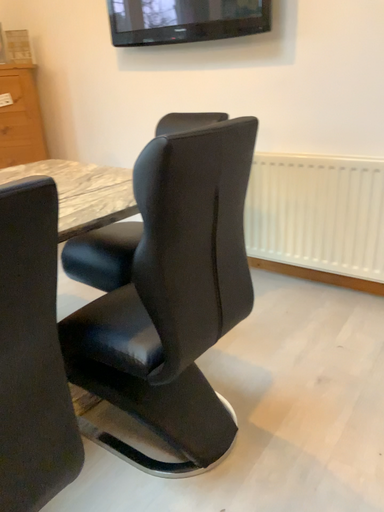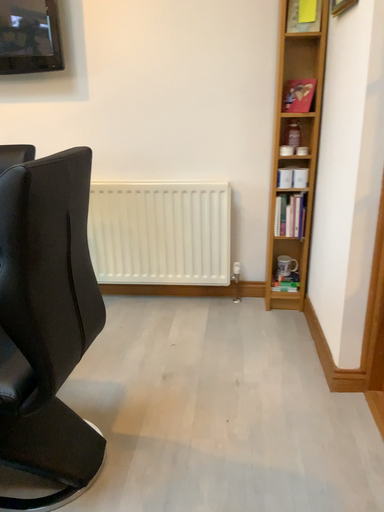
Question: Which way did the camera rotate in the video?

Choices:
 (A) rotated left
 (B) rotated right

Answer: (B)